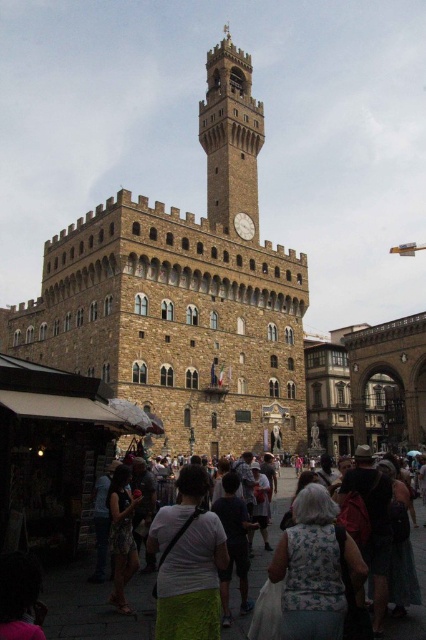
Question: Which of the following is the farthest from the observer?

Choices:
 (A) dark gray fabric crowd at lower center
 (B) floral dress at lower left

Answer: (B)

Question: In this image, where is floral dress at lower left located relative to white matte clock at center?

Choices:
 (A) right
 (B) left

Answer: (B)

Question: In this image, where is brown stone tower at center located relative to stone clock tower at center?

Choices:
 (A) left
 (B) right

Answer: (A)

Question: Among these objects, which one is nearest to the camera?

Choices:
 (A) stone clock tower at center
 (B) white fabric at center
 (C) brown stone tower at center
 (D) white matte clock at center

Answer: (B)

Question: Can you confirm if dark gray fabric crowd at lower center is positioned to the left of floral dress at lower left?

Choices:
 (A) yes
 (B) no

Answer: (B)

Question: Which object is farther from the camera taking this photo?

Choices:
 (A) white matte clock at center
 (B) brown stone tower at center
 (C) floral dress at lower left

Answer: (A)